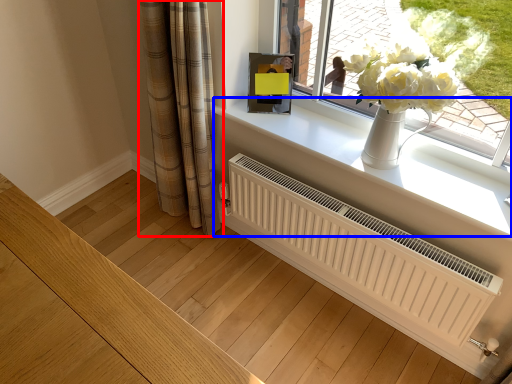
Question: Which of the following is the farthest to the observer, curtain (highlighted by a red box) or window sill (highlighted by a blue box)?

Choices:
 (A) curtain
 (B) window sill

Answer: (A)